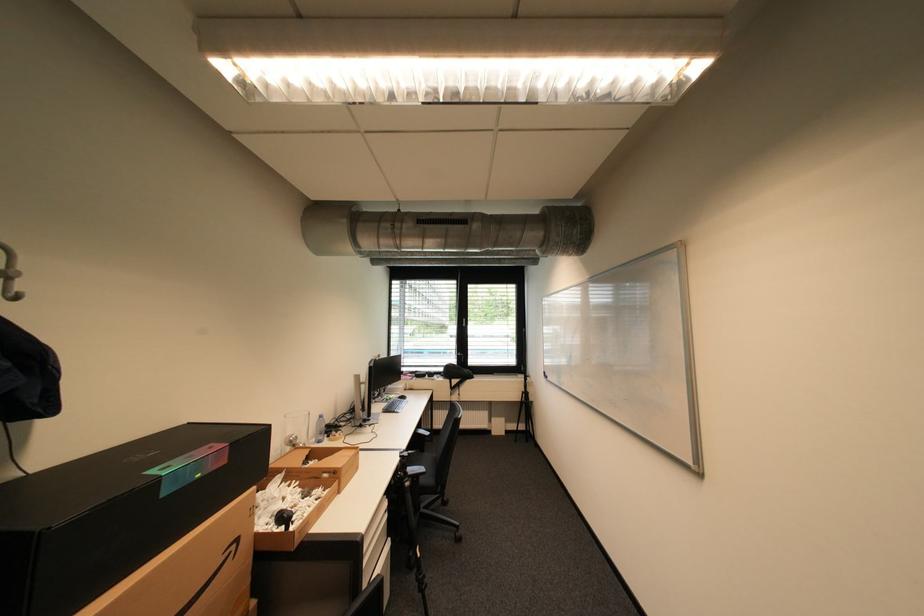
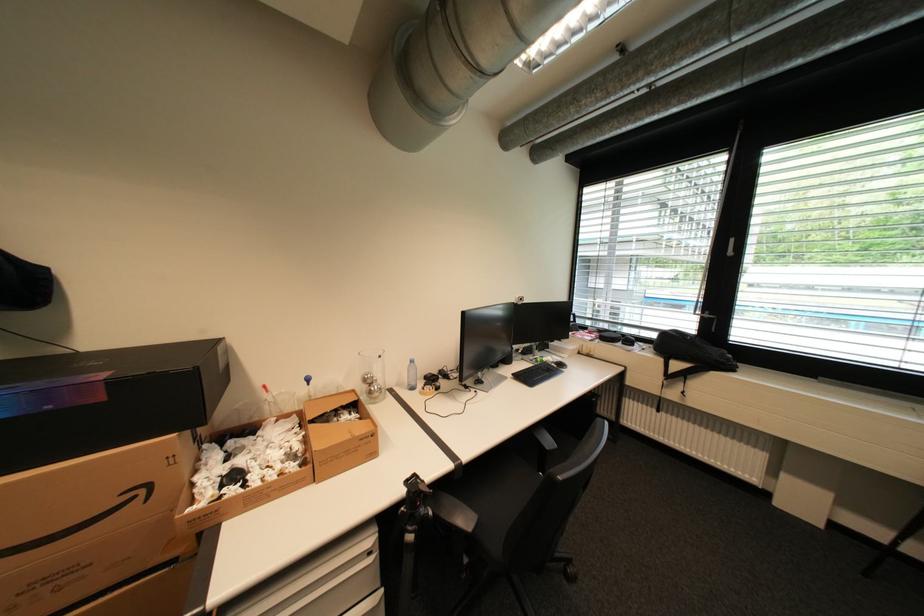
The point at (242,546) is marked in the first image. Where is the corresponding point in the second image?

(151, 491)